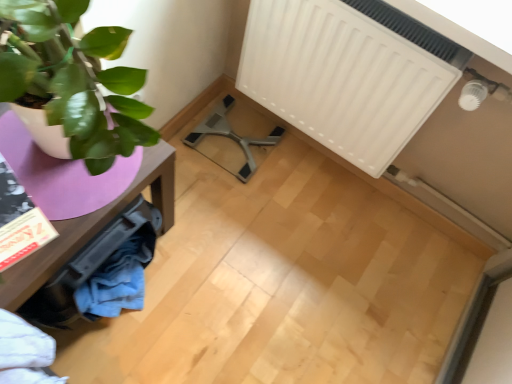
Locate an element on the screen. white matte radiator at upper right is located at coordinates pos(347,73).

Where is `matte purple table at left`? matte purple table at left is located at coordinates coord(92,227).

Is point (140, 181) positioned after point (205, 141)?

That is False.

From the image's perspective, which is below, matte purple table at left or metallic gray swivel chair at center?

From the image's view, matte purple table at left is below.

Is matte purple table at left further to the viewer compared to metallic gray swivel chair at center?

No, it is not.

Is metallic gray swivel chair at center at the back of matte purple table at left?

Yes, matte purple table at left is positioned with its back facing metallic gray swivel chair at center.

Can you confirm if metallic gray swivel chair at center is shorter than matte purple table at left?

Yes, metallic gray swivel chair at center is shorter than matte purple table at left.

What's the angular difference between metallic gray swivel chair at center and matte purple table at left's facing directions?

They differ by 2.42 degrees in their facing directions.

Could you tell me if metallic gray swivel chair at center is facing matte purple table at left?

Yes, metallic gray swivel chair at center is turned towards matte purple table at left.

Which is behind, point (227, 119) or point (11, 289)?

The point (227, 119) is farther from the camera.

Is metallic gray swivel chair at center completely or partially outside of white matte radiator at upper right?

Yes.

From the image's perspective, is metallic gray swivel chair at center located above or below white matte radiator at upper right?

metallic gray swivel chair at center is situated lower than white matte radiator at upper right in the image.

Which point is more distant from viewer, (238, 151) or (382, 163)?

Point (238, 151)

Which object is further away from the camera taking this photo, metallic gray swivel chair at center or white matte radiator at upper right?

metallic gray swivel chair at center is further away from the camera.

Who is bigger, white matte radiator at upper right or matte purple table at left?

Bigger between the two is matte purple table at left.

Considering the positions of objects white matte radiator at upper right and matte purple table at left in the image provided, who is more to the left, white matte radiator at upper right or matte purple table at left?

matte purple table at left.

Is white matte radiator at upper right not inside matte purple table at left?

Yes, white matte radiator at upper right is outside of matte purple table at left.

Considering the sizes of objects white matte radiator at upper right and metallic gray swivel chair at center in the image provided, who is taller, white matte radiator at upper right or metallic gray swivel chair at center?

white matte radiator at upper right is taller.

Is white matte radiator at upper right further to camera compared to metallic gray swivel chair at center?

No, white matte radiator at upper right is in front of metallic gray swivel chair at center.

Consider the image. Considering the positions of objects white matte radiator at upper right and metallic gray swivel chair at center in the image provided, who is more to the left, white matte radiator at upper right or metallic gray swivel chair at center?

metallic gray swivel chair at center.

Which is in front, point (308, 100) or point (249, 154)?

Point (308, 100)

Considering their positions, is matte purple table at left located in front of or behind white matte radiator at upper right?

matte purple table at left is positioned closer to the viewer than white matte radiator at upper right.

Is matte purple table at left next to white matte radiator at upper right and touching it?

matte purple table at left and white matte radiator at upper right are not in contact.

From a real-world perspective, between matte purple table at left and white matte radiator at upper right, who is vertically higher?

white matte radiator at upper right.

How much distance is there between matte purple table at left and white matte radiator at upper right?

matte purple table at left and white matte radiator at upper right are 23.34 inches apart from each other.

Find the location of a particular element. table that is on the left side of metallic gray swivel chair at center is located at coordinates (92, 227).

Where is `swivel chair below the matte purple table at left (from a real-world perspective)`? The height and width of the screenshot is (384, 512). swivel chair below the matte purple table at left (from a real-world perspective) is located at coordinates (230, 141).

When comparing their distances from metallic gray swivel chair at center, does matte purple table at left or white matte radiator at upper right seem closer?

Based on the image, white matte radiator at upper right appears to be nearer to metallic gray swivel chair at center.

Considering their positions, is matte purple table at left positioned further to white matte radiator at upper right than metallic gray swivel chair at center?

Based on the image, matte purple table at left appears to be further to white matte radiator at upper right.

From the image, which object appears to be nearer to matte purple table at left, metallic gray swivel chair at center or white matte radiator at upper right?

metallic gray swivel chair at center is positioned closer to the anchor matte purple table at left.

From the picture: From the image, which object appears to be nearer to white matte radiator at upper right, metallic gray swivel chair at center or matte purple table at left?

Among the two, metallic gray swivel chair at center is located nearer to white matte radiator at upper right.

When comparing their distances from matte purple table at left, does white matte radiator at upper right or metallic gray swivel chair at center seem closer?

metallic gray swivel chair at center is positioned closer to the anchor matte purple table at left.

From the picture: Considering their positions, is white matte radiator at upper right positioned further to metallic gray swivel chair at center than matte purple table at left?

Based on the image, matte purple table at left appears to be further to metallic gray swivel chair at center.

Where is `swivel chair between matte purple table at left and white matte radiator at upper right`? This screenshot has width=512, height=384. swivel chair between matte purple table at left and white matte radiator at upper right is located at coordinates (230, 141).